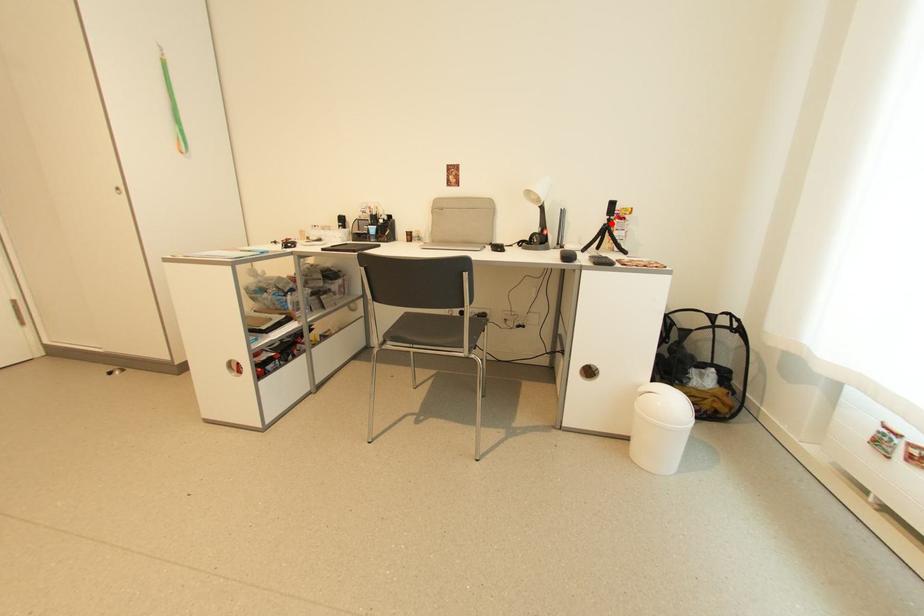
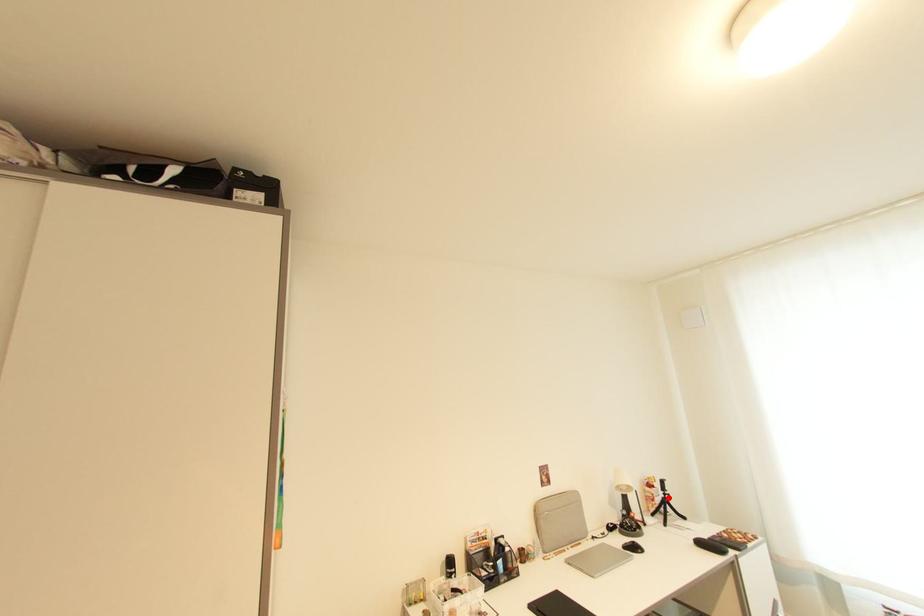
Looking at this image, I am providing you with two images of the same scene from different viewpoints. A red point is marked on the first image and another point is marked on the second image. Is the marked point in image1 the same physical position as the marked point in image2?

Yes